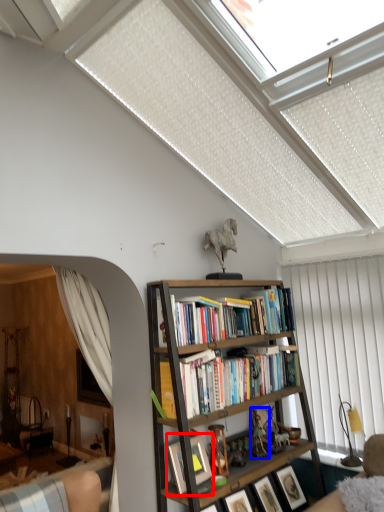
Question: Which of the following is the farthest to the observer, picture frame (highlighted by a red box) or toy (highlighted by a blue box)?

Choices:
 (A) picture frame
 (B) toy

Answer: (B)